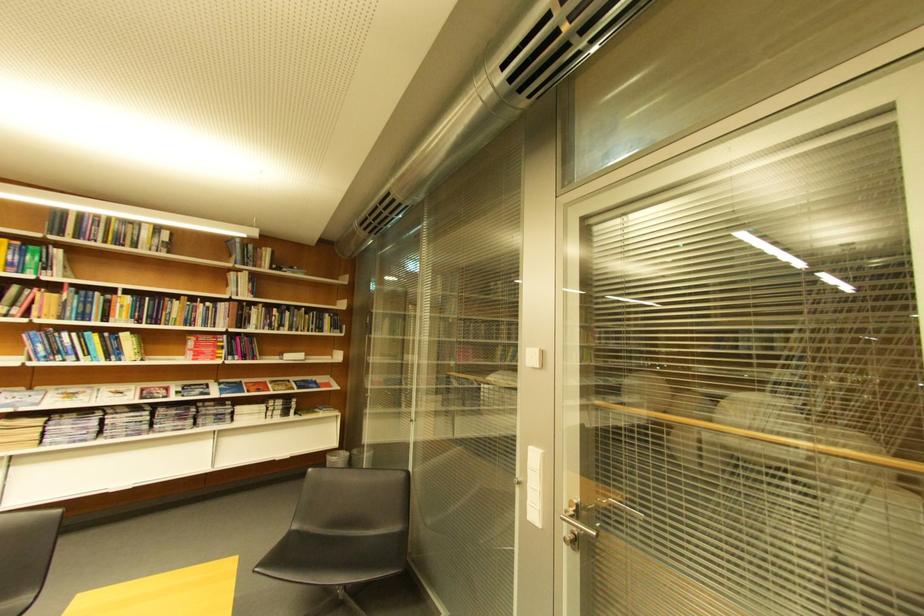
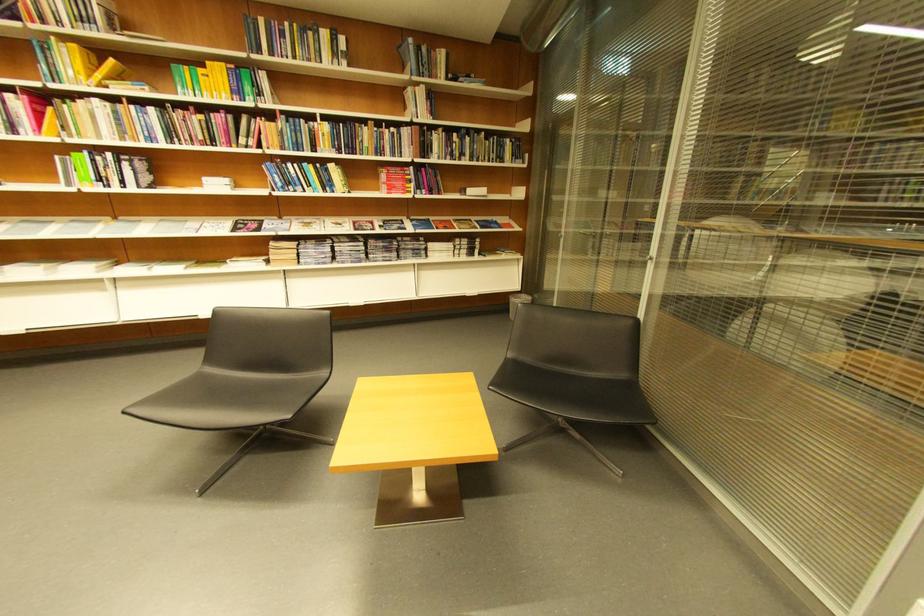
Question: I am providing you with two images of the same scene from different viewpoints. Which of the following objects are not visible in image2?

Choices:
 (A) magazine
 (B) black chair sitting surface
 (C) small trash can
 (D) none of these

Answer: (D)